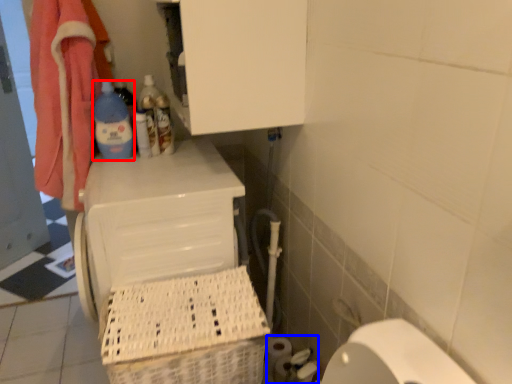
Question: Which object is further to the camera taking this photo, bottle (highlighted by a red box) or toilet paper (highlighted by a blue box)?

Choices:
 (A) bottle
 (B) toilet paper

Answer: (A)